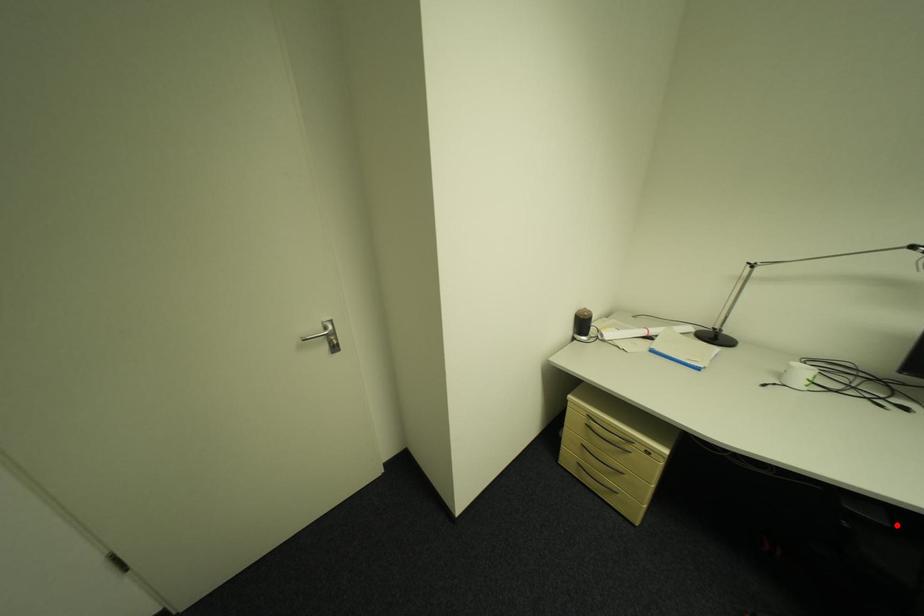
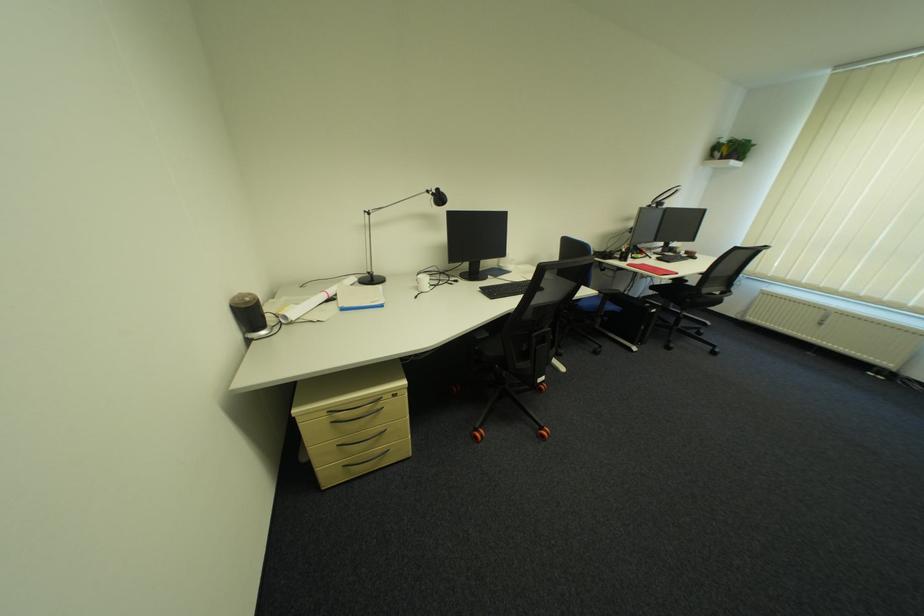
Question: I am providing you with two images of the same scene from different viewpoints. In image1, a red point is highlighted. Considering the same 3D point in image2, which of the following is correct?

Choices:
 (A) It is closer
 (B) It is farther

Answer: (B)